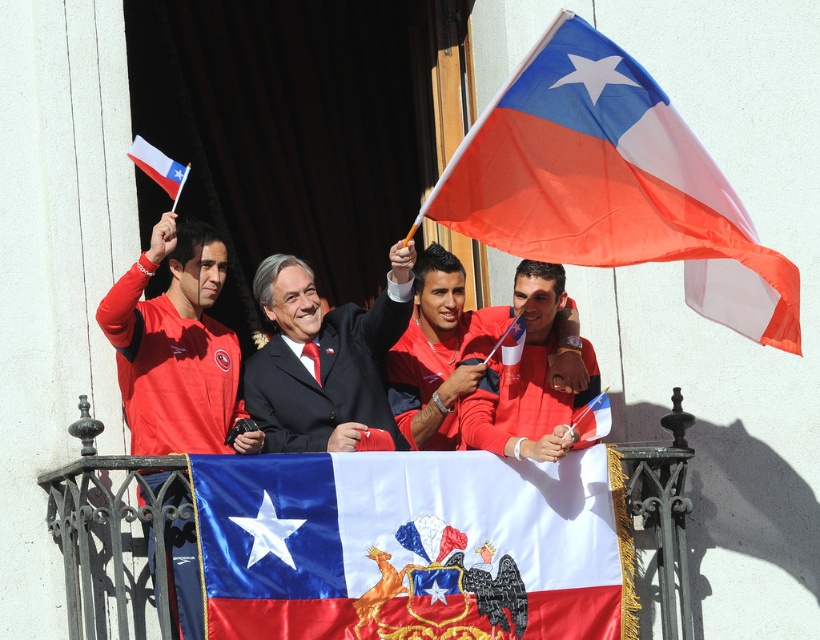
You are a photographer trying to capture a clear shot of the matte red shirt at center without the matte orange flag at upper right blocking it. Based on their positions, is this possible?

The matte orange flag at upper right is positioned over the matte red shirt at center, so it is blocking the view. To capture a clear shot of the matte red shirt at center without the flag, you would need to adjust your angle or move the flag.

You are a photographer trying to capture the matte orange flag at upper right. You notice a point marked at coordinates (611, 184). Based on the scene description, where is this point likely located relative to the matte orange flag at upper right?

The point at coordinates (611, 184) indicates the location of the matte orange flag at upper right.

Consider the image. You are standing on the balcony and want to place a small flag at point A and a large flag at point B. Given that point A is point (311, 548) and point B is point (513, 410), which point is closer to you so the small flag can be more visible?

Point (311, 548) is closer to the viewer than point (513, 410), so placing the small flag there would make it more visible.